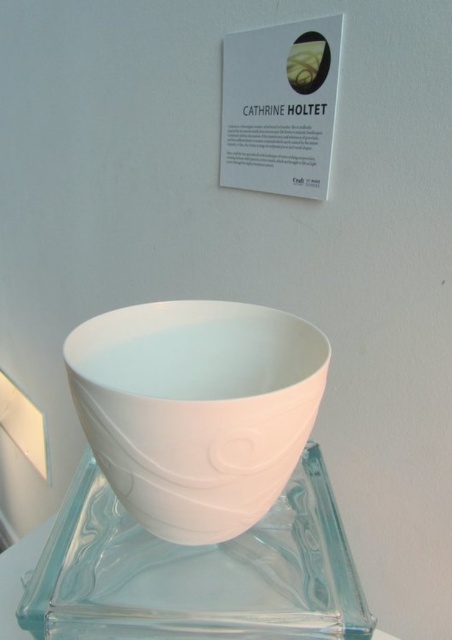
Question: Considering the relative positions of white matte bowl at center and transparent glass plate at center in the image provided, where is white matte bowl at center located with respect to transparent glass plate at center?

Choices:
 (A) right
 (B) left

Answer: (A)

Question: Is white matte bowl at center bigger than transparent glass plate at center?

Choices:
 (A) yes
 (B) no

Answer: (A)

Question: Which point is closer to the camera?

Choices:
 (A) (198, 456)
 (B) (113, 634)

Answer: (A)

Question: Among these points, which one is nearest to the camera?

Choices:
 (A) (326, 605)
 (B) (232, 412)

Answer: (B)

Question: Does white matte bowl at center appear over transparent glass plate at center?

Choices:
 (A) no
 (B) yes

Answer: (B)